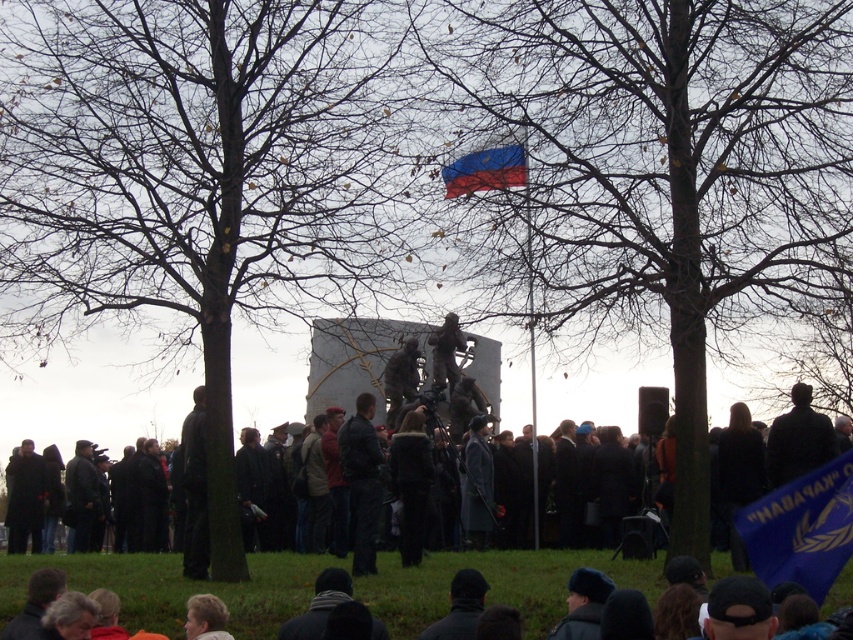
Does bare wood tree at center have a lesser width compared to dark gray coat at center?

Yes.

Can you confirm if bare wood tree at center is positioned to the right of dark gray coat at center?

Incorrect, bare wood tree at center is not on the right side of dark gray coat at center.

Does point (363, 132) come closer to viewer compared to point (759, 436)?

Yes.

I want to click on bare wood tree at center, so click(201, 177).

Does bare wood tree at center appear on the right side of metallic pole at center?

No, bare wood tree at center is not to the right of metallic pole at center.

Who is positioned more to the left, bare wood tree at center or metallic pole at center?

Positioned to the left is bare wood tree at center.

I want to click on bare wood tree at center, so click(201, 177).

What do you see at coordinates (363, 481) in the screenshot? I see `dark gray jacket at center` at bounding box center [363, 481].

Where is `dark gray jacket at center`? Image resolution: width=853 pixels, height=640 pixels. dark gray jacket at center is located at coordinates (363, 481).

Is point (370, 476) farther from camera compared to point (310, 413)?

No, (370, 476) is in front of (310, 413).

Locate an element on the screen. dark gray jacket at center is located at coordinates (363, 481).